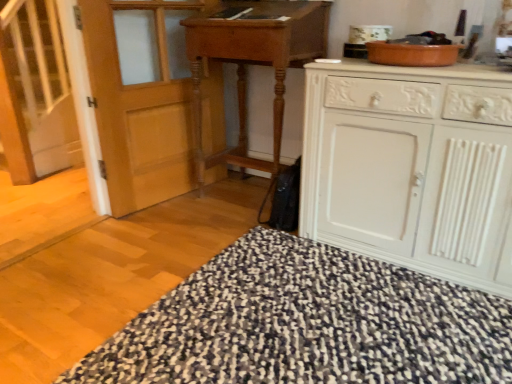
This screenshot has width=512, height=384. I want to click on blank space to the left of wooden table at center, so click(173, 215).